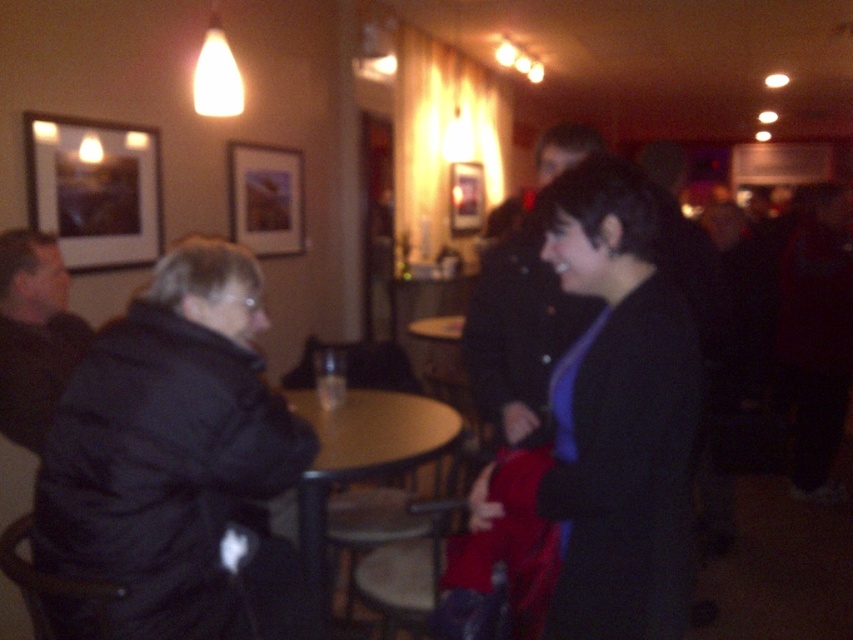
Which is in front, point (44, 300) or point (347, 435)?

Positioned in front is point (44, 300).

Can you confirm if dark gray jacket at left is smaller than wooden round table at center?

Yes, dark gray jacket at left is smaller than wooden round table at center.

What do you see at coordinates (33, 333) in the screenshot? I see `dark gray jacket at left` at bounding box center [33, 333].

This screenshot has height=640, width=853. I want to click on dark gray jacket at left, so click(x=33, y=333).

Does matte black picture frame at upper left have a larger size compared to wooden framed picture at upper center?

Actually, matte black picture frame at upper left might be smaller than wooden framed picture at upper center.

Looking at this image, is matte black picture frame at upper left shorter than wooden framed picture at upper center?

No.

You are a GUI agent. You are given a task and a screenshot of the screen. Output one action in this format:
    pyautogui.click(x=<x>, y=<y>)
    Task: Click on the matte black picture frame at upper left
    This screenshot has height=640, width=853.
    Given the screenshot: What is the action you would take?
    pyautogui.click(x=96, y=189)

Which is behind, point (485, 332) or point (96, 225)?

Positioned behind is point (96, 225).

What do you see at coordinates (518, 332) in the screenshot?
I see `dark blue jacket at center` at bounding box center [518, 332].

Does point (482, 340) lie behind point (85, 252)?

That is False.

Locate an element on the screen. The height and width of the screenshot is (640, 853). dark blue jacket at center is located at coordinates (518, 332).